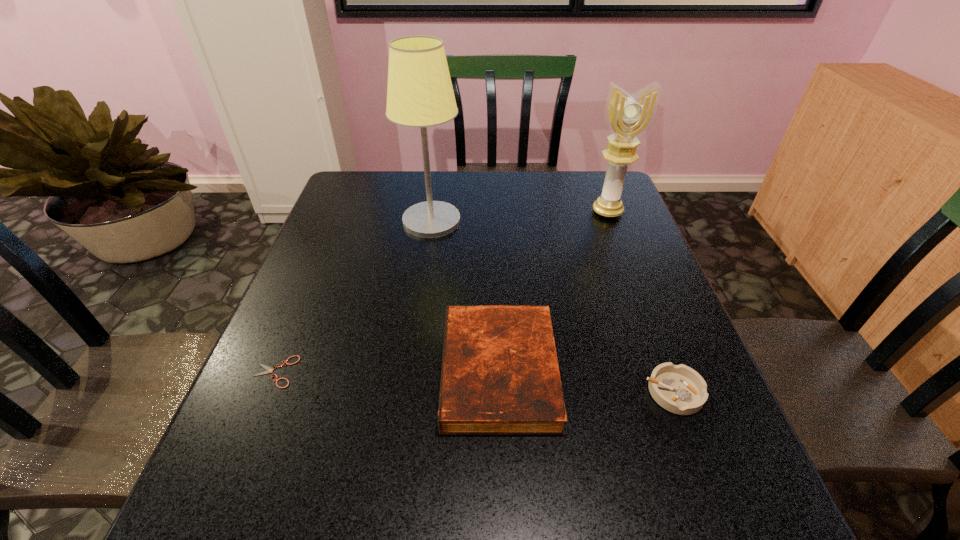
Locate an element on the screen. This screenshot has width=960, height=540. free space between the tallest object and the ashtray is located at coordinates (553, 307).

Where is `free space between the ashtray and the third shortest object`? The image size is (960, 540). free space between the ashtray and the third shortest object is located at coordinates (587, 382).

Locate an element on the screen. Image resolution: width=960 pixels, height=540 pixels. free space between the award and the table lamp is located at coordinates (519, 216).

Select which object appears as the fourth closest to the second shortest object. Please provide its 2D coordinates. Your answer should be formatted as a tuple, i.e. [(x, y)], where the tuple contains the x and y coordinates of a point satisfying the conditions above.

[(269, 370)]

Point out which object is positioned as the second nearest to the ashtray. Please provide its 2D coordinates. Your answer should be formatted as a tuple, i.e. [(x, y)], where the tuple contains the x and y coordinates of a point satisfying the conditions above.

[(628, 116)]

Where is `vacant space that satisfies the following two spatial constraints: 1. on the front-facing side of the award; 2. on the spine side of the Bible`? The height and width of the screenshot is (540, 960). vacant space that satisfies the following two spatial constraints: 1. on the front-facing side of the award; 2. on the spine side of the Bible is located at coordinates (668, 371).

Locate an element on the screen. free space that satisfies the following two spatial constraints: 1. on the front side of the fourth tallest object; 2. on the left side of the table lamp is located at coordinates (407, 392).

At what (x,y) coordinates should I click in order to perform the action: click on vacant region that satisfies the following two spatial constraints: 1. on the spine side of the Bible; 2. on the front side of the shortest object. Please return your answer as a coordinate pair (x, y). The height and width of the screenshot is (540, 960). Looking at the image, I should click on (499, 372).

This screenshot has width=960, height=540. Find the location of `free space that satisfies the following two spatial constraints: 1. on the front-facing side of the award; 2. on the spine side of the Bible`. free space that satisfies the following two spatial constraints: 1. on the front-facing side of the award; 2. on the spine side of the Bible is located at coordinates (668, 371).